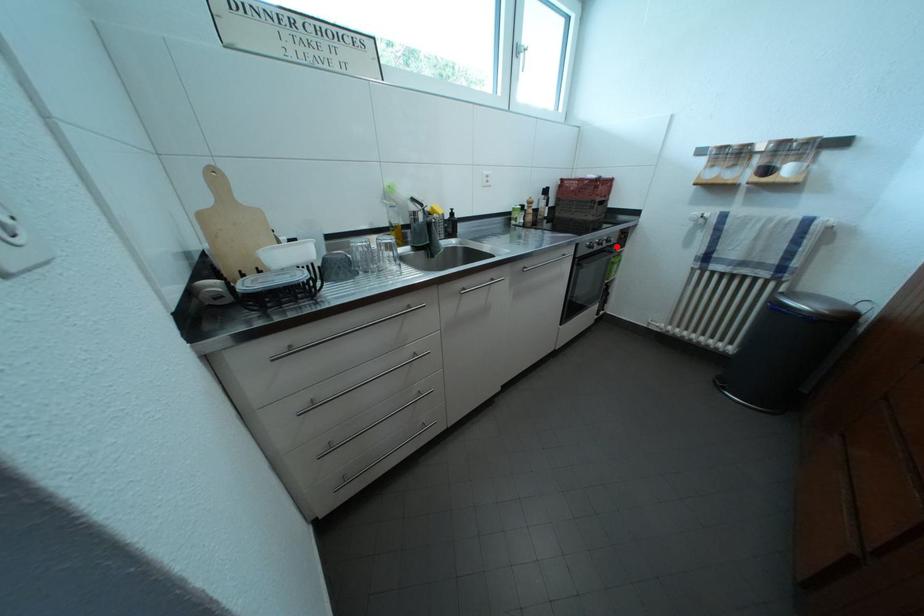
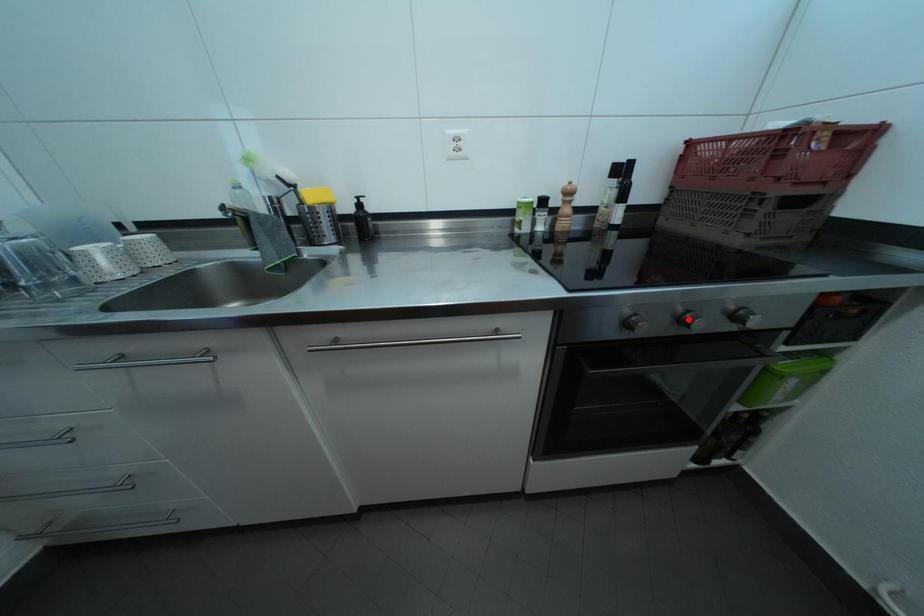
I am providing you with two images of the same scene from different viewpoints. A red point is marked on the first image and another point is marked on the second image. Is the marked point in image1 the same physical position as the marked point in image2?

No